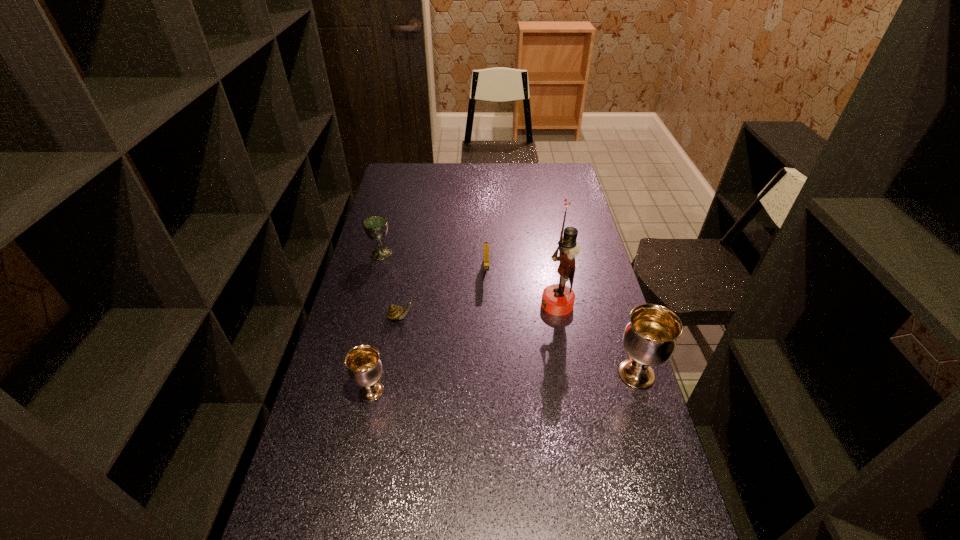
To achieve even spacing by inserting another chalice among them, please point to a vacant spot for this new chalice. Please provide its 2D coordinates. Your answer should be formatted as a tuple, i.e. [(x, y)], where the tuple contains the x and y coordinates of a point satisfying the conditions above.

[(506, 382)]